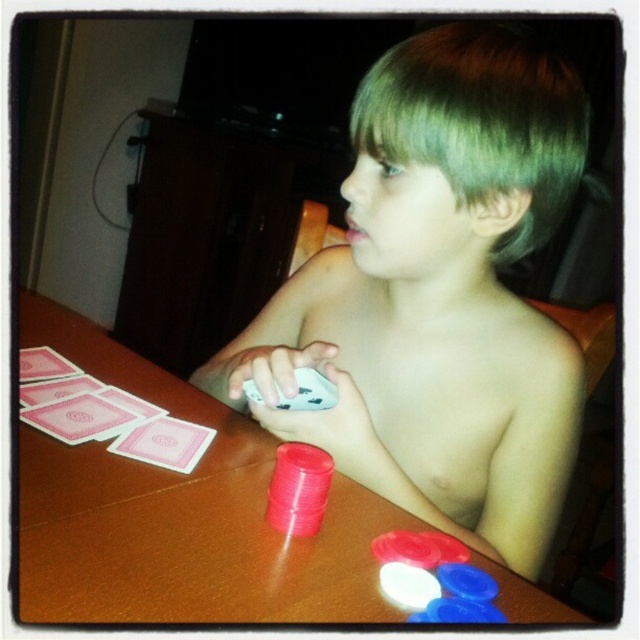
Question: Which point is farther to the camera?

Choices:
 (A) pink paper cards at left
 (B) shiny plastic cards at center
 (C) smooth plastic poker chips at center
 (D) smooth plastic chips at lower right

Answer: (A)

Question: Is shiny plastic cards at center thinner than smooth plastic chips at lower right?

Choices:
 (A) no
 (B) yes

Answer: (A)

Question: Observing the image, what is the correct spatial positioning of shiny plastic cards at center in reference to smooth plastic poker chips at center?

Choices:
 (A) left
 (B) right

Answer: (B)

Question: Which is nearer to the green matte hair at upper center?

Choices:
 (A) smooth plastic poker chips at center
 (B) smooth plastic chips at lower right
 (C) pink paper cards at left

Answer: (A)

Question: Which point appears farthest from the camera in this image?

Choices:
 (A) (499, 454)
 (B) (269, 492)
 (C) (104, 424)

Answer: (A)

Question: Does brown wooden table at center appear on the right side of pink paper cards at left?

Choices:
 (A) no
 (B) yes

Answer: (B)